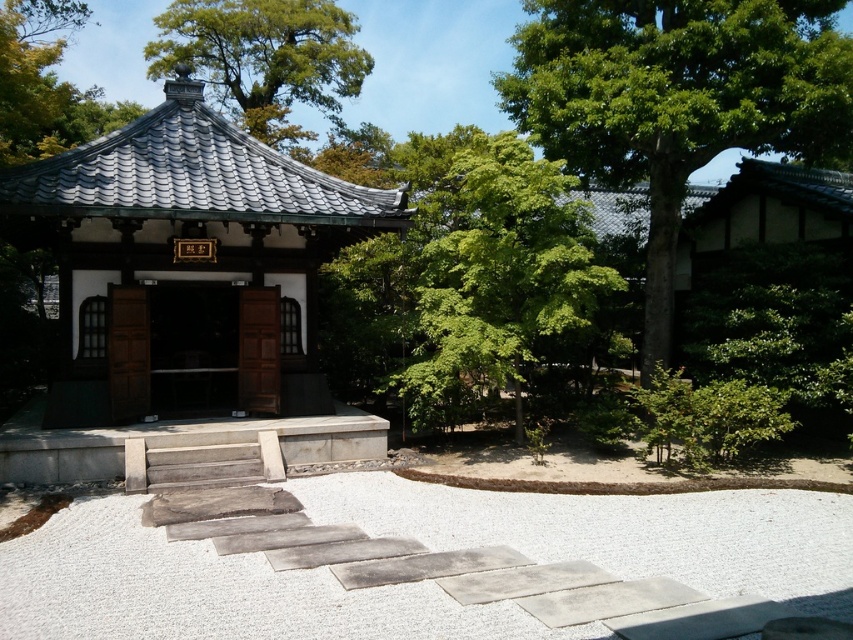
Which of these two, white gravel at center or wooden door at center, stands taller?

wooden door at center

Is white gravel at center bigger than wooden door at center?

Actually, white gravel at center might be smaller than wooden door at center.

Find the location of a particular element. white gravel at center is located at coordinates (212, 589).

Can you confirm if white gravel at center is bigger than green leafy tree at center?

No.

Can you confirm if white gravel at center is smaller than green leafy tree at center?

Correct, white gravel at center occupies less space than green leafy tree at center.

Describe the element at coordinates (212, 589) in the screenshot. I see `white gravel at center` at that location.

Image resolution: width=853 pixels, height=640 pixels. In order to click on white gravel at center in this screenshot , I will do `click(212, 589)`.

Is green leafy tree at center to the left of green leafy tree at upper left from the viewer's perspective?

In fact, green leafy tree at center is to the right of green leafy tree at upper left.

Is point (390, 236) positioned before point (39, 125)?

Yes, point (390, 236) is in front of point (39, 125).

Is point (502, 339) positioned before point (103, 125)?

Yes, point (502, 339) is in front of point (103, 125).

Locate an element on the screen. green leafy tree at center is located at coordinates (467, 275).